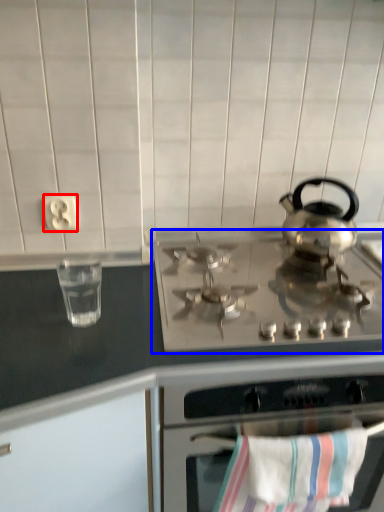
Question: Which object appears closest to the camera in this image, electric outlet (highlighted by a red box) or gas stove (highlighted by a blue box)?

Choices:
 (A) electric outlet
 (B) gas stove

Answer: (B)